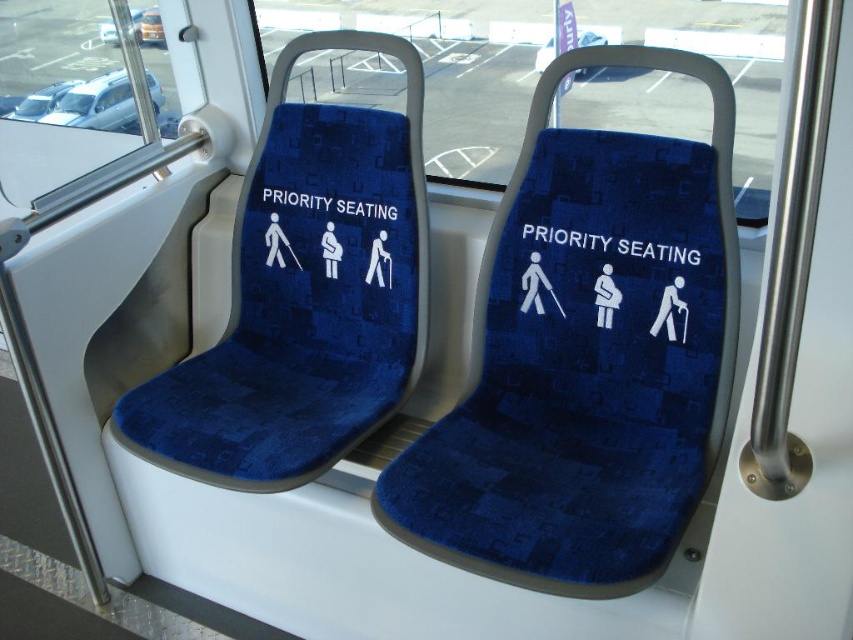
Looking at this image, who is positioned more to the right, blue fabric priority seating at center or white fabric priority seating at center?

blue fabric priority seating at center

Who is more forward, (x=666, y=244) or (x=297, y=204)?

Positioned in front is point (x=666, y=244).

What do you see at coordinates (612, 243) in the screenshot?
I see `blue fabric priority seating at center` at bounding box center [612, 243].

Where is `blue fabric priority seating at center`? The height and width of the screenshot is (640, 853). blue fabric priority seating at center is located at coordinates (612, 243).

Which is more to the left, metallic silver car at upper left or blue fabric priority seating at center?

metallic silver car at upper left

Can you confirm if metallic silver car at upper left is shorter than blue fabric priority seating at center?

Incorrect, metallic silver car at upper left's height does not fall short of blue fabric priority seating at center's.

Consider the image. Who is more forward, (128, 124) or (602, 244)?

Point (602, 244) is in front.

In order to click on metallic silver car at upper left in this screenshot , I will do `click(96, 104)`.

Can you confirm if metallic silver car at upper left is positioned to the right of white fabric priority seating at center?

No, metallic silver car at upper left is not to the right of white fabric priority seating at center.

Is point (73, 97) positioned after point (276, 193)?

Yes, point (73, 97) is farther from viewer.

I want to click on metallic silver car at upper left, so click(x=96, y=104).